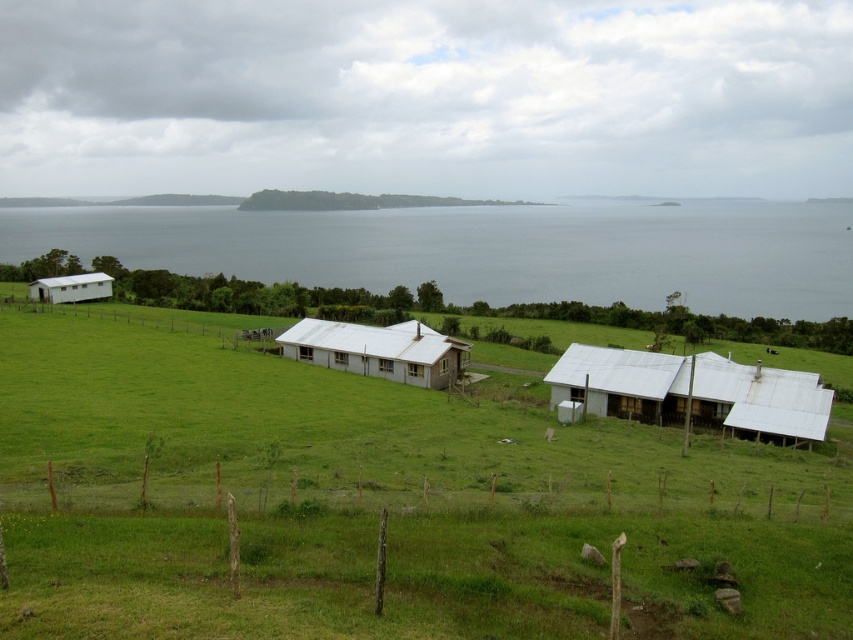
Question: Is white corrugated metal barn at center-right to the right of white matte barn at left from the viewer's perspective?

Choices:
 (A) yes
 (B) no

Answer: (A)

Question: Does white corrugated metal barn at center appear on the right side of white matte barn at left?

Choices:
 (A) yes
 (B) no

Answer: (A)

Question: Estimate the real-world distances between objects in this image. Which object is closer to the white matte barn at left?

Choices:
 (A) white corrugated metal barn at center
 (B) white corrugated metal barn at center-right
 (C) blue water at center

Answer: (A)

Question: Which point is closer to the camera?

Choices:
 (A) white matte barn at left
 (B) blue water at center
 (C) white corrugated metal barn at center
 (D) white corrugated metal barn at center-right

Answer: (D)

Question: Is blue water at center positioned at the back of white corrugated metal barn at center-right?

Choices:
 (A) yes
 (B) no

Answer: (A)

Question: Among these points, which one is nearest to the camera?

Choices:
 (A) (616, 388)
 (B) (437, 348)
 (C) (80, 289)

Answer: (A)